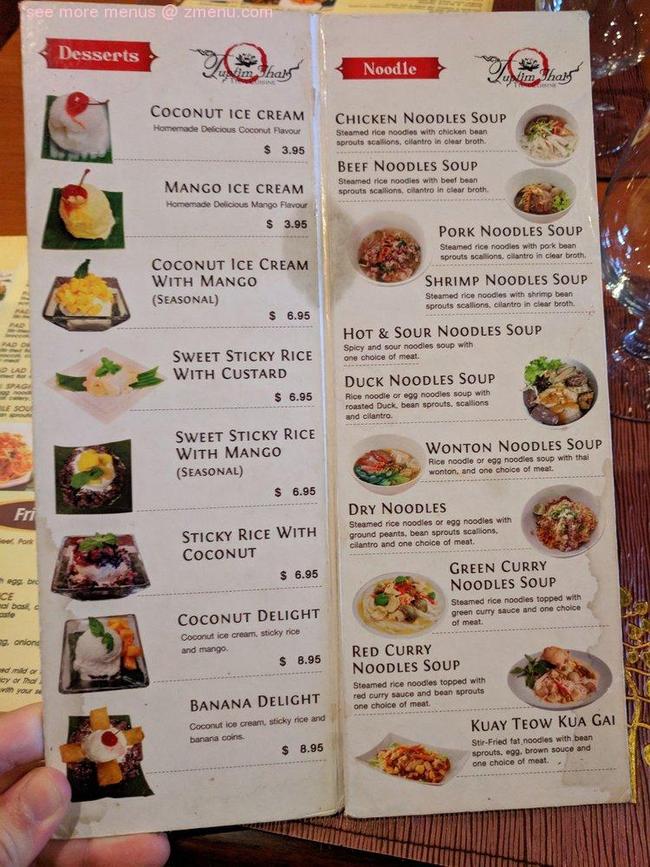
Where is `square white plate`? square white plate is located at coordinates (110, 405).